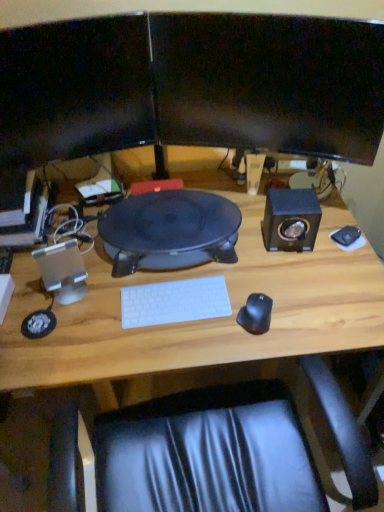
Where is `free space above white plastic keyboard at center (from a real-world perspective)`? The width and height of the screenshot is (384, 512). free space above white plastic keyboard at center (from a real-world perspective) is located at coordinates (173, 298).